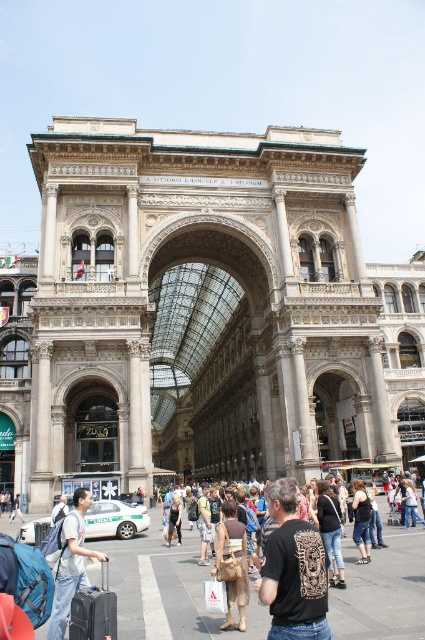
Measure the distance between point (337,538) and camera.

Point (337,538) and camera are 116.19 feet apart.

Is point (333, 573) closer to viewer compared to point (357, 518)?

Yes, it is.

Is point (317, 500) in front of point (353, 500)?

Yes, point (317, 500) is in front of point (353, 500).

Where is `denim jeans at center`? denim jeans at center is located at coordinates (331, 531).

Is matte black crowd at center taller than black leather jacket at center?

Yes.

Who is more distant from viewer, (x=261, y=637) or (x=170, y=513)?

Positioned behind is point (x=170, y=513).

Measure the distance between matte black crowd at center and camera.

24.87 meters

This screenshot has width=425, height=640. In order to click on matte black crowd at center in this screenshot , I will do `click(382, 589)`.

Who is more distant from viewer, (238, 525) or (325, 492)?

The point (325, 492) is more distant.

Who is more distant from viewer, (218, 557) or (337, 572)?

Point (337, 572)

This screenshot has height=640, width=425. I want to click on brown leather bag at center, so click(x=232, y=564).